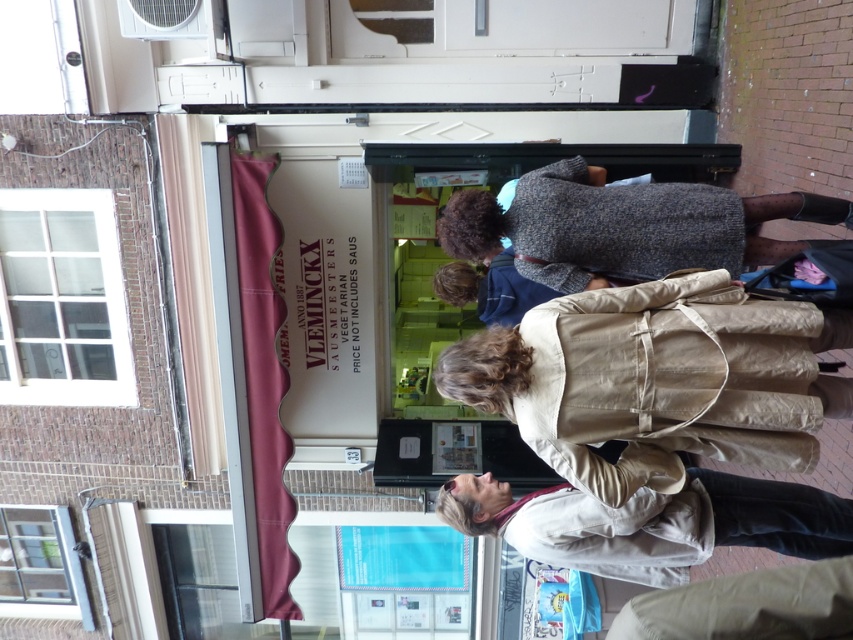
Question: Can you confirm if beige fabric coat at lower center is wider than light beige jacket at lower center?

Choices:
 (A) no
 (B) yes

Answer: (A)

Question: Is beige fabric coat at lower center bigger than knitted sweater at center?

Choices:
 (A) yes
 (B) no

Answer: (B)

Question: Which point is closer to the camera?

Choices:
 (A) beige fabric coat at lower center
 (B) light beige jacket at lower center
 (C) knitted sweater at center

Answer: (A)

Question: Among these objects, which one is nearest to the camera?

Choices:
 (A) light beige jacket at lower center
 (B) knitted sweater at center

Answer: (A)

Question: Which of the following is the farthest from the observer?

Choices:
 (A) (704, 202)
 (B) (759, 461)

Answer: (A)

Question: Can you confirm if knitted sweater at center is positioned above light beige jacket at lower center?

Choices:
 (A) no
 (B) yes

Answer: (B)